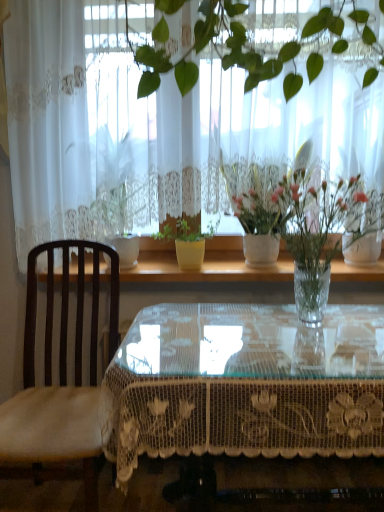
Question: Is white lace curtain at upper center completely or partially outside of white ceramic vase at upper center, which is the 2th houseplant from left to right?

Choices:
 (A) no
 (B) yes

Answer: (B)

Question: From the image's perspective, does white lace curtain at upper center appear higher than white ceramic vase at upper center, the 1th houseplant when ordered from right to left?

Choices:
 (A) yes
 (B) no

Answer: (A)

Question: Could white ceramic vase at upper center, which is the 2th houseplant from left to right, be considered to be inside white lace curtain at upper center?

Choices:
 (A) yes
 (B) no

Answer: (A)

Question: Can you see white lace curtain at upper center touching white ceramic vase at upper center, the 1th houseplant when ordered from right to left?

Choices:
 (A) no
 (B) yes

Answer: (A)

Question: Does white lace curtain at upper center have a greater width compared to white ceramic vase at upper center, the 1th houseplant when ordered from right to left?

Choices:
 (A) yes
 (B) no

Answer: (B)

Question: Does white lace curtain at upper center appear on the right side of white ceramic vase at upper center, which is the 2th houseplant from left to right?

Choices:
 (A) no
 (B) yes

Answer: (A)

Question: Can you confirm if white glossy pot at center, acting as the 1th houseplant starting from the left, is taller than transparent glass table at center?

Choices:
 (A) no
 (B) yes

Answer: (B)

Question: Is white glossy pot at center, which ranks as the 2th houseplant in right-to-left order, far away from transparent glass table at center?

Choices:
 (A) no
 (B) yes

Answer: (A)

Question: Can you confirm if white glossy pot at center, which ranks as the 2th houseplant in right-to-left order, is wider than transparent glass table at center?

Choices:
 (A) yes
 (B) no

Answer: (B)

Question: Can you confirm if white glossy pot at center, which ranks as the 2th houseplant in right-to-left order, is bigger than transparent glass table at center?

Choices:
 (A) yes
 (B) no

Answer: (A)

Question: Is white glossy pot at center, which ranks as the 2th houseplant in right-to-left order, shorter than transparent glass table at center?

Choices:
 (A) no
 (B) yes

Answer: (A)

Question: From a real-world perspective, is white glossy pot at center, which ranks as the 2th houseplant in right-to-left order, below transparent glass table at center?

Choices:
 (A) no
 (B) yes

Answer: (A)

Question: Considering the relative positions of white lace curtain at upper center and transparent lace-covered table at center in the image provided, is white lace curtain at upper center behind transparent lace-covered table at center?

Choices:
 (A) yes
 (B) no

Answer: (A)